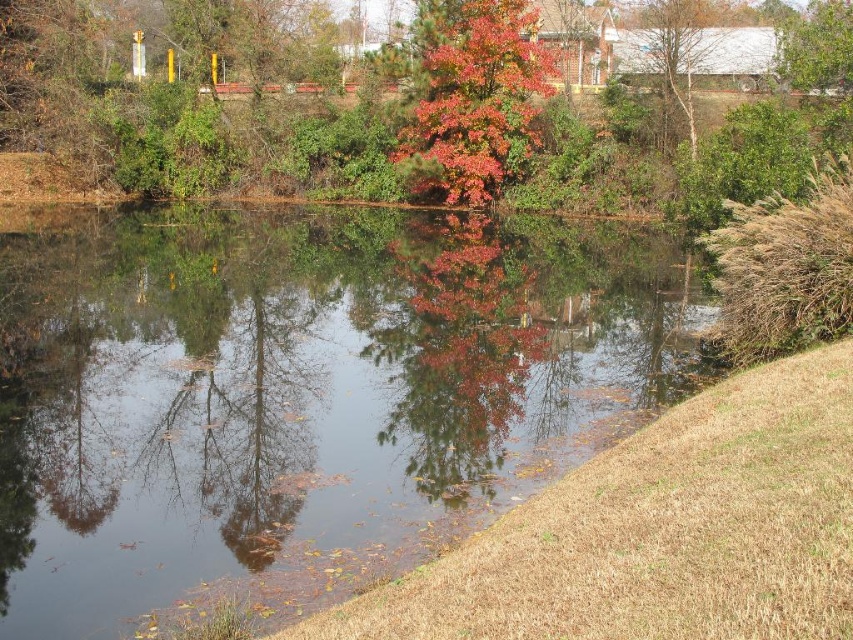
You are an artist trying to paint the autumn scene. You notice both the transparent water at center and autumn leaves at center. Which object should you paint first if you want to follow the rule of painting smaller objects before larger ones?

The transparent water at center is smaller than autumn leaves at center, so you should paint the transparent water at center first.

You are a bird flying over the autumn scene. You want to land on the closest object between the autumn leaves at center and the bare branches at upper right. Which one should you choose?

The autumn leaves at center are closer to your current position as a bird flying over the scene, so you should land there.

You are standing at the edge of the grassy embankment on the right side of the scene. You want to cross to the other side of the water. Can you see the transparent water at center from your current position? Please explain why.

Yes, you can see the transparent water at center because it is located at point (306, 392), which is within the visible area from the grassy embankment on the right side.